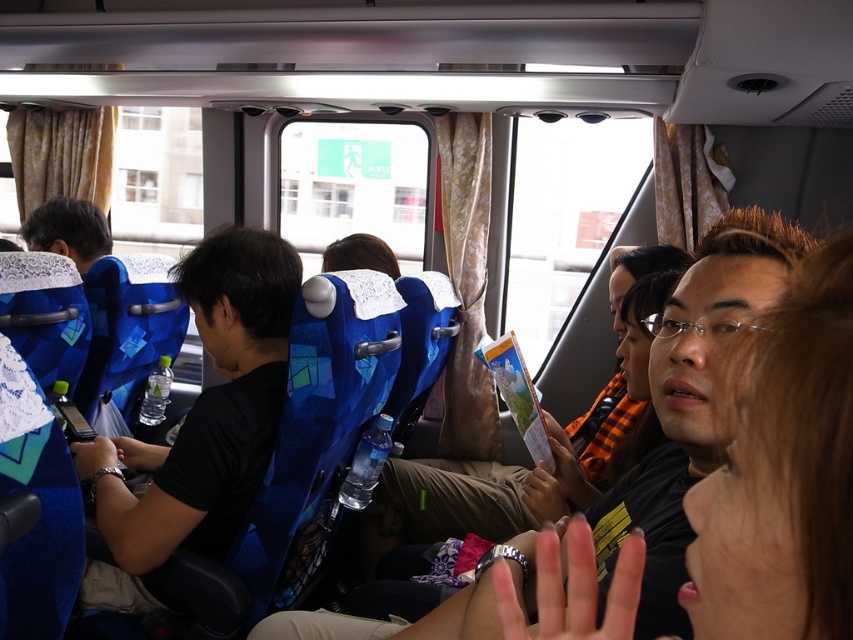
You are a passenger sitting in the middle of the bus and see the black matte shirt at center and the matte black hair at left. Which object is higher from the ground?

The black matte shirt at center is taller than the matte black hair at left, so the black matte shirt at center is higher from the ground.

You are a passenger sitting in the bus and want to know the position of the black matte shirt at center and matte black hair at left. Which one is located to the right side?

The black matte shirt at center is located to the right of the matte black hair at left.